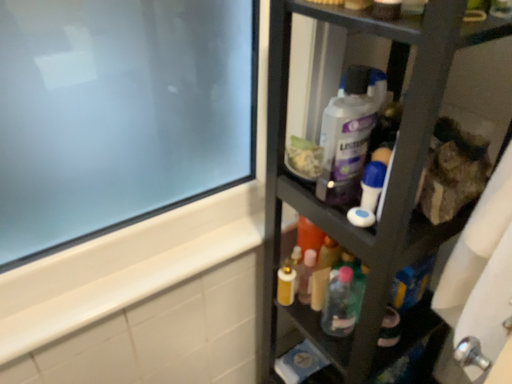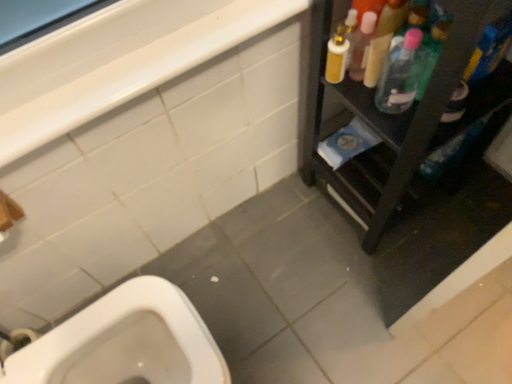
Question: How did the camera likely rotate when shooting the video?

Choices:
 (A) rotated downward
 (B) rotated upward

Answer: (A)